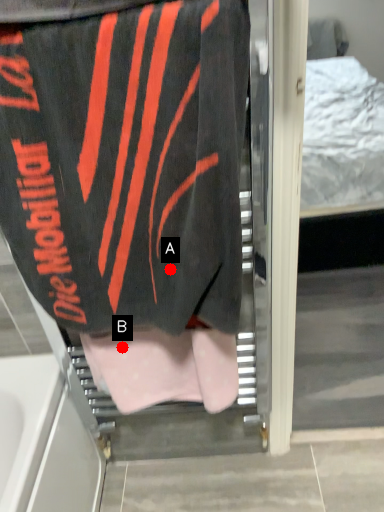
Question: Two points are circled on the image, labeled by A and B beside each circle. Which point appears closest to the camera in this image?

Choices:
 (A) A is closer
 (B) B is closer

Answer: (A)